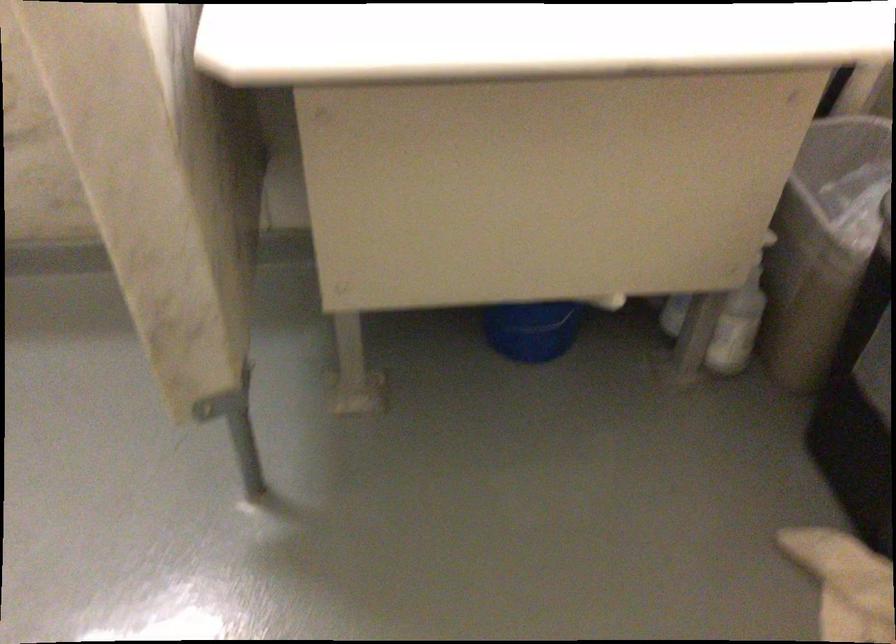
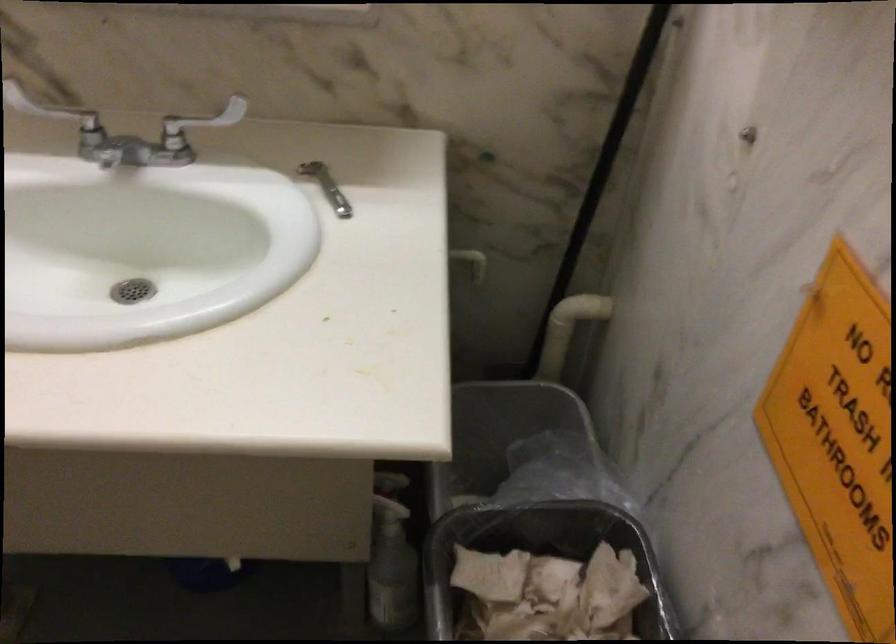
Question: How did the camera likely rotate?

Choices:
 (A) Left
 (B) Right
 (C) Up
 (D) Down

Answer: (C)